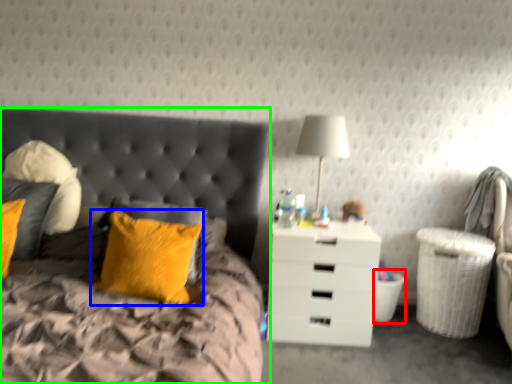
Question: Which object is positioned farthest from laundry basket (highlighted by a red box)? Select from pillow (highlighted by a blue box) and bed (highlighted by a green box).

Choices:
 (A) pillow
 (B) bed

Answer: (B)